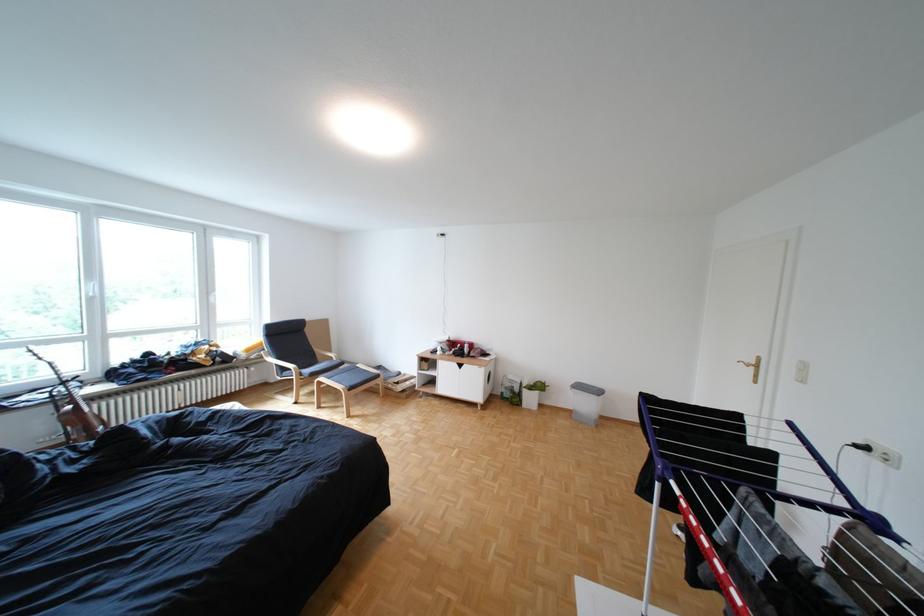
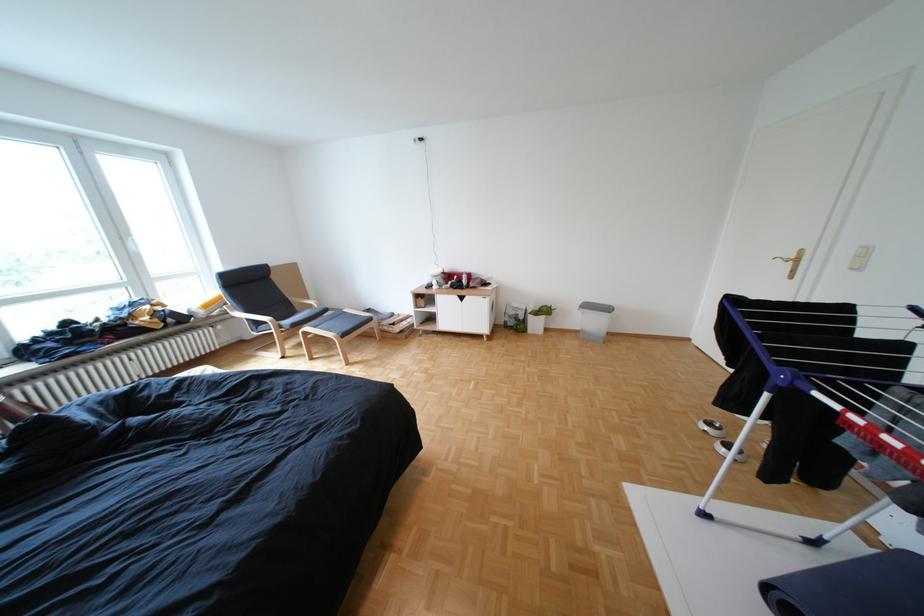
In the second image, find the point that corresponds to point (393, 377) in the first image.

(386, 320)